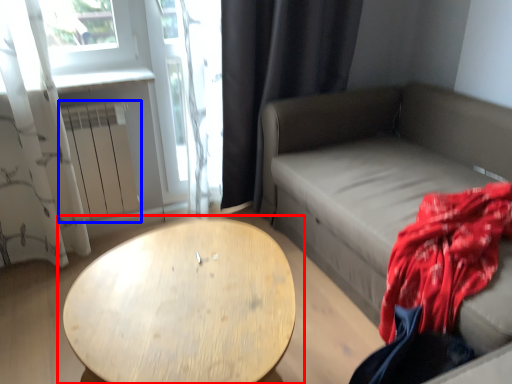
Question: Among these objects, which one is farthest to the camera, table (highlighted by a red box) or radiator (highlighted by a blue box)?

Choices:
 (A) table
 (B) radiator

Answer: (B)